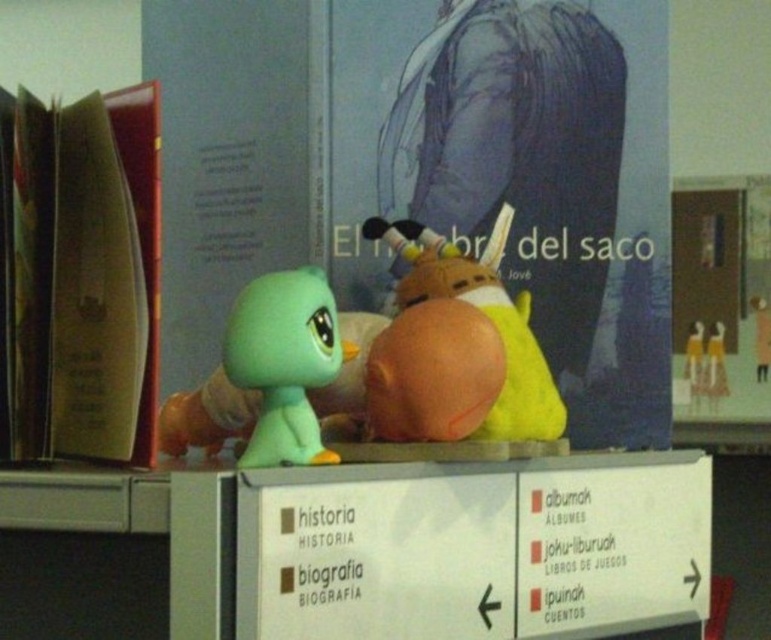
Describe the element at coordinates (520, 177) in the screenshot. The width and height of the screenshot is (771, 640). I see `matte blue poster at center` at that location.

Which is behind, point (440, 136) or point (157, 140)?

Point (440, 136)

The image size is (771, 640). What are the coordinates of `matte blue poster at center` in the screenshot? It's located at (520, 177).

Between point (610, 324) and point (409, 291), which one is positioned behind?

The point (610, 324) is behind.

Does point (428, 180) come behind point (426, 234)?

That is True.

I want to click on matte blue poster at center, so click(x=520, y=177).

Is brown leather book at left positioned before matte yellow plush at center?

Yes, brown leather book at left is closer to the viewer.

Image resolution: width=771 pixels, height=640 pixels. What do you see at coordinates (86, 276) in the screenshot? I see `brown leather book at left` at bounding box center [86, 276].

I want to click on brown leather book at left, so click(86, 276).